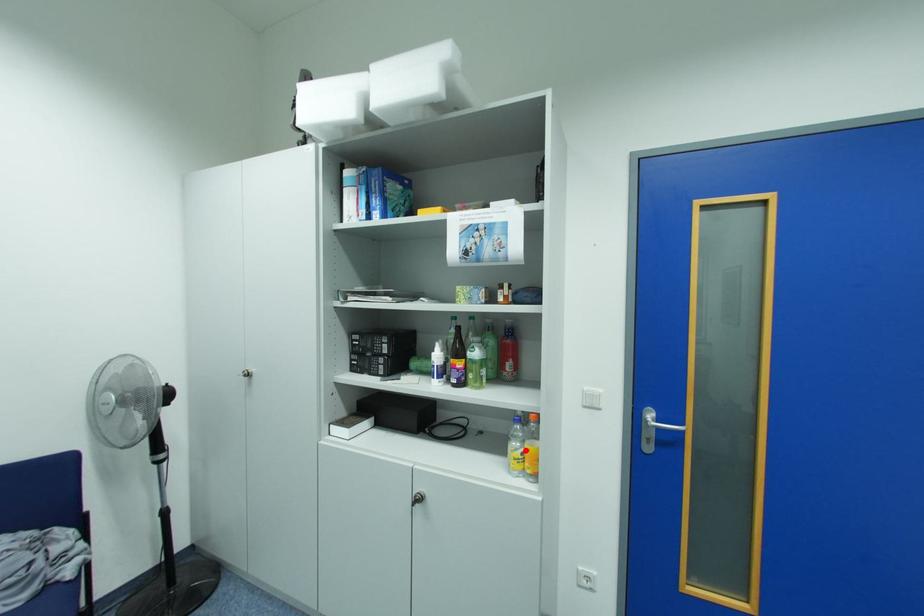
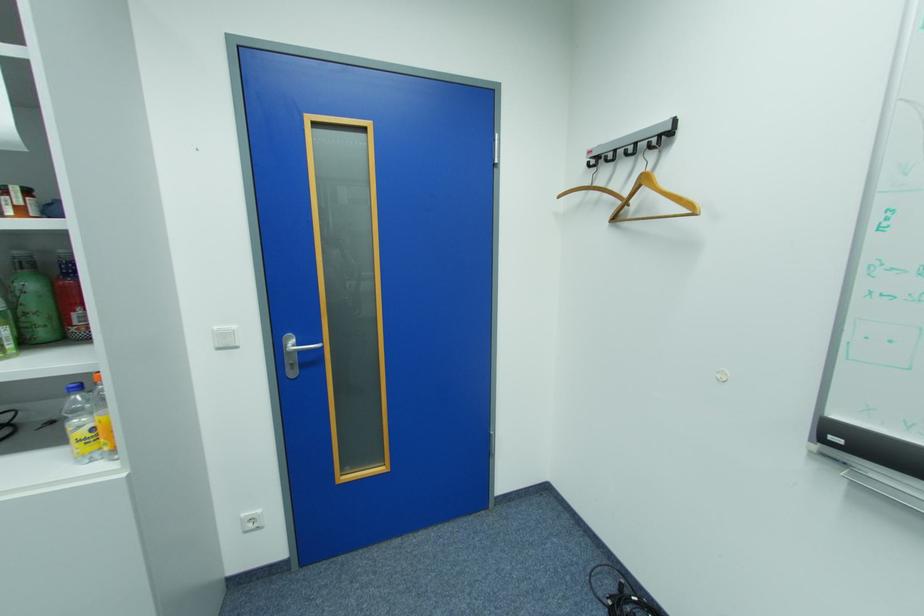
Question: I am providing you with two images of the same scene from different viewpoints. Image1 has a red point marked. In image2, the corresponding 3D location appears at what relative position? Reply with the corresponding letter.

Choices:
 (A) Closer
 (B) Farther

Answer: (A)